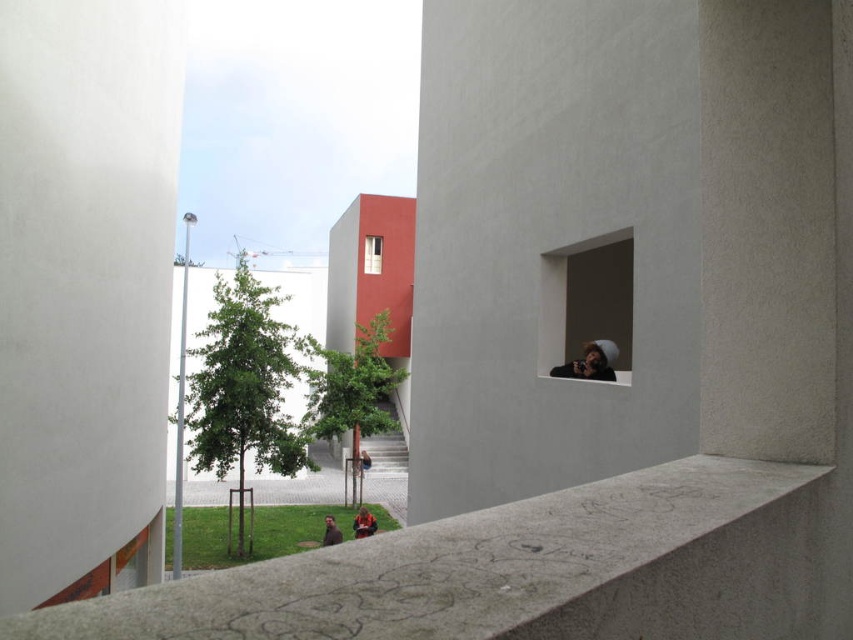
You are standing in the architectural scene described. You want to move from your current position to a point closer to the camera. Which of the two points, point (590, 369) or point (364, 522), should you head towards?

You should head towards point (590, 369) because it is closer to the camera than point (364, 522) according to the description.

You are a delivery drone with a wingspan of 1.5 meters. You need to fly from the concrete ledge at lower center to the matte gray window at upper right. Is there enough space between them for your wingspan?

The distance between the concrete ledge at lower center and the matte gray window at upper right is 7.06 meters, which is significantly larger than the drone wingspan of 1.5 meters. Therefore, there is ample space for the drone to navigate between them without any issues.

You are standing in the modern architectural scene described. There is a point at coordinates point (x=271, y=630). Can you reach this point without moving your feet?

The point at point (x=271, y=630) is 1.03 meters away from you, so you cannot reach it without moving your feet since it is slightly farther than an average person can reach.